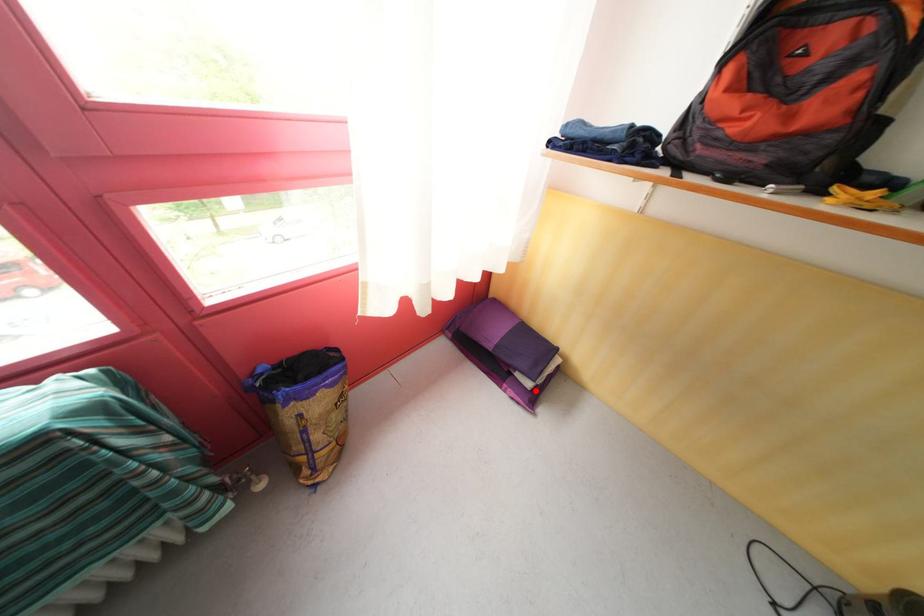
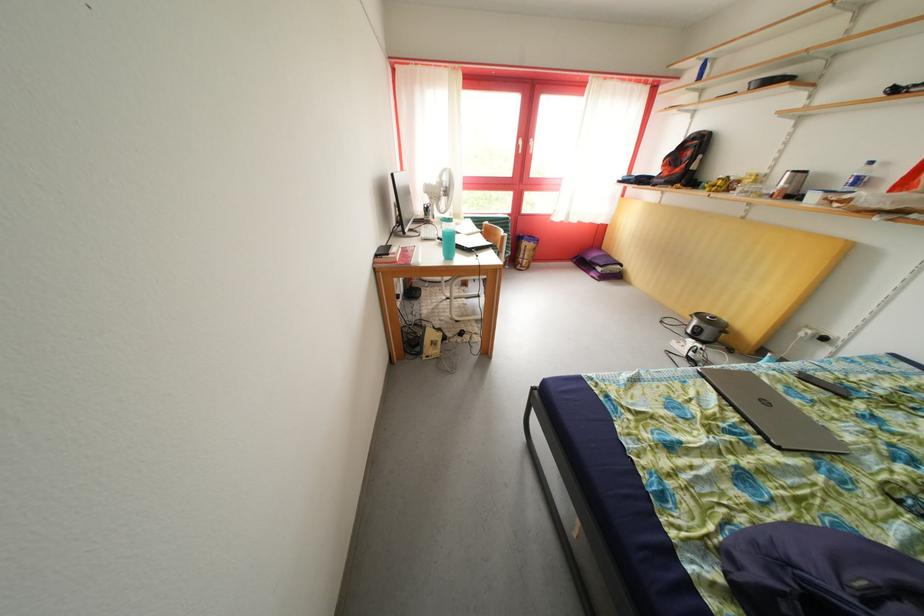
Question: I am providing you with two images of the same scene from different viewpoints. Given a red point in image1, look at the same physical point in image2. Is it:

Choices:
 (A) Closer to the viewpoint
 (B) Farther from the viewpoint

Answer: (A)